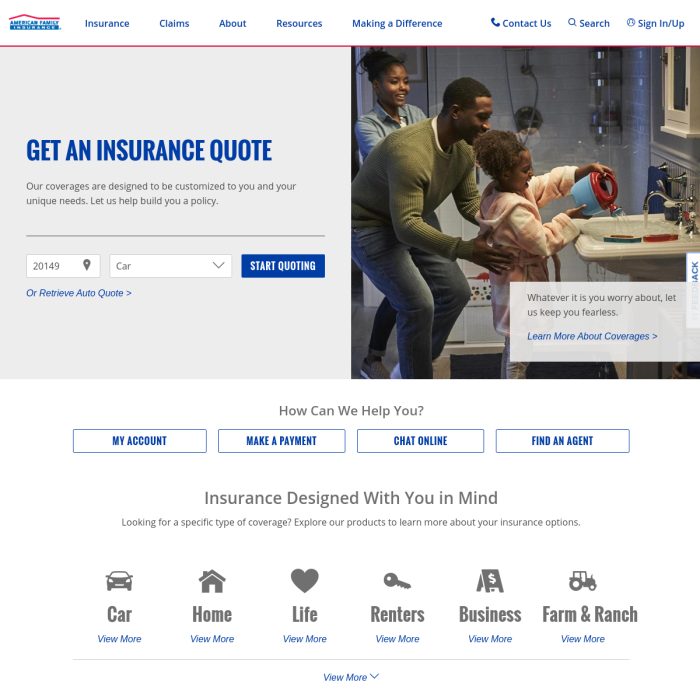
Identify the location of bathroom sink. The image size is (700, 700). (617, 251).